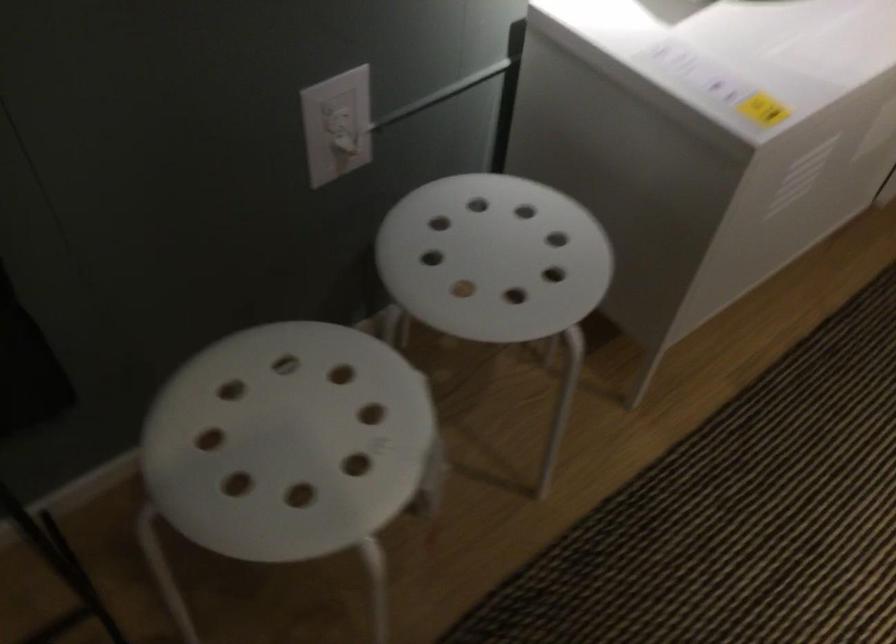
This screenshot has width=896, height=644. In order to click on white electrical plug in this screenshot , I will do `click(337, 125)`.